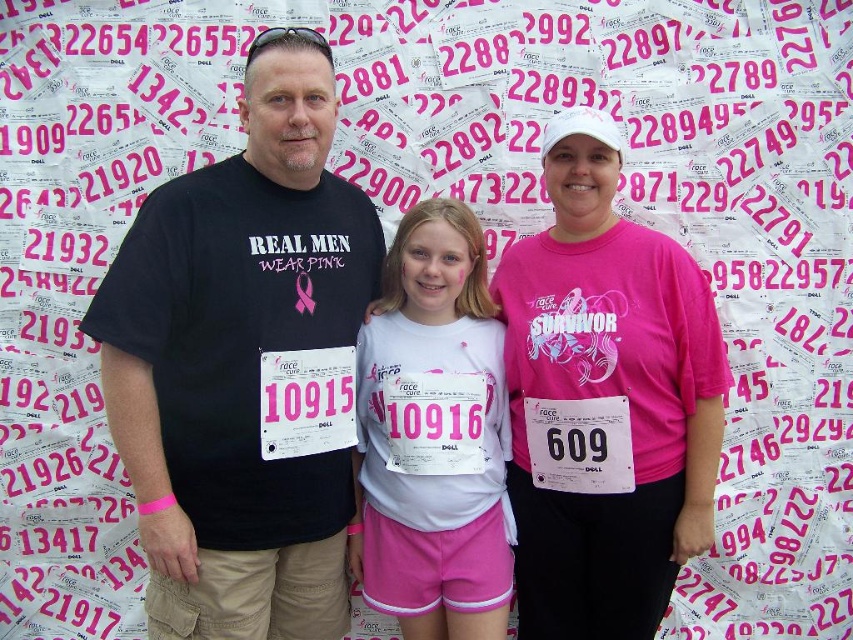
Question: Which of these objects is positioned closest to the white fabric shirt at center?

Choices:
 (A) matte black t-shirt at center
 (B) black matte t-shirt at center
 (C) pink matte shirt at center

Answer: (C)

Question: Does matte black t-shirt at center have a lesser width compared to white fabric shirt at center?

Choices:
 (A) yes
 (B) no

Answer: (A)

Question: Can you confirm if pink matte shirt at center is thinner than white fabric shirt at center?

Choices:
 (A) yes
 (B) no

Answer: (B)

Question: Estimate the real-world distances between objects in this image. Which object is closer to the matte black t-shirt at center?

Choices:
 (A) white fabric shirt at center
 (B) pink matte shirt at center
 (C) black matte t-shirt at center

Answer: (C)

Question: From the image, what is the correct spatial relationship of matte black t-shirt at center in relation to black matte t-shirt at center?

Choices:
 (A) right
 (B) left

Answer: (B)

Question: Which object appears closest to the camera in this image?

Choices:
 (A) matte black t-shirt at center
 (B) black matte t-shirt at center
 (C) white fabric shirt at center
 (D) pink matte shirt at center

Answer: (B)